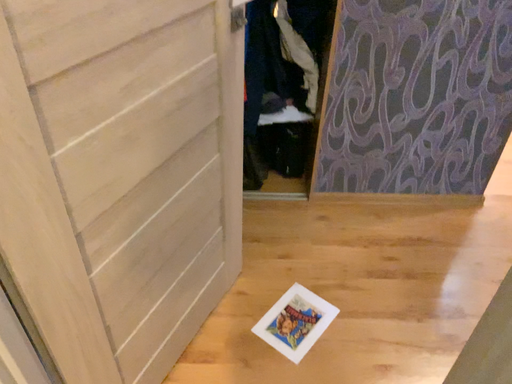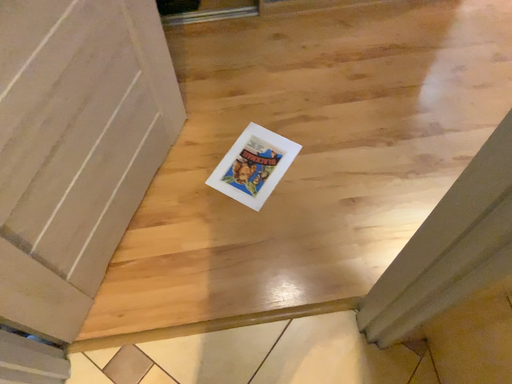
Question: Which way did the camera rotate in the video?

Choices:
 (A) rotated upward
 (B) rotated downward

Answer: (B)